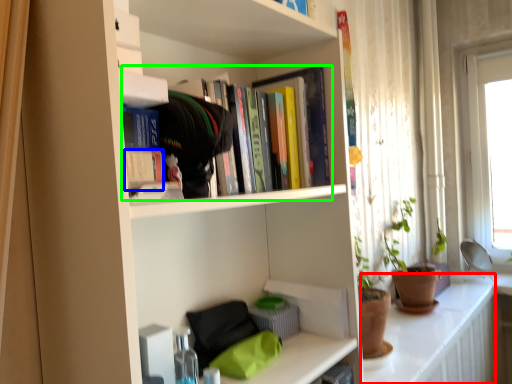
Question: Considering the real-world distances, which object is closest to counter top (highlighted by a red box)? paperback book (highlighted by a blue box) or book (highlighted by a green box).

Choices:
 (A) paperback book
 (B) book

Answer: (B)